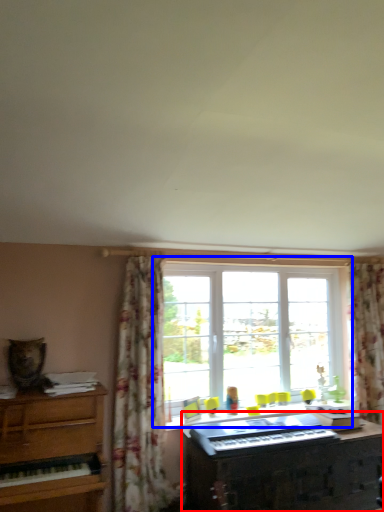
Question: Which of the following is the farthest to the observer, piano (highlighted by a red box) or window (highlighted by a blue box)?

Choices:
 (A) piano
 (B) window

Answer: (B)